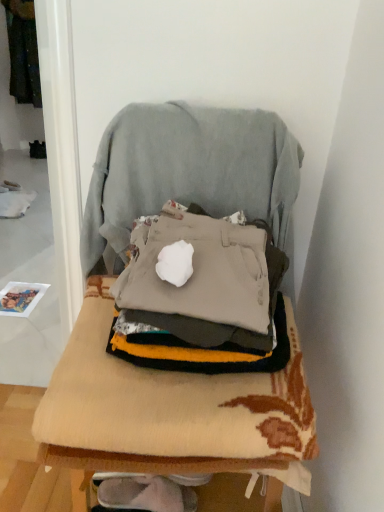
Question: From the image's perspective, is dark green fabric at upper left under light gray fabric swivel chair at center?

Choices:
 (A) yes
 (B) no

Answer: (B)

Question: From a real-world perspective, is dark green fabric at upper left over light gray fabric swivel chair at center?

Choices:
 (A) no
 (B) yes

Answer: (B)

Question: Is dark green fabric at upper left beside light gray fabric swivel chair at center?

Choices:
 (A) no
 (B) yes

Answer: (A)

Question: Can you confirm if dark green fabric at upper left is shorter than light gray fabric swivel chair at center?

Choices:
 (A) yes
 (B) no

Answer: (B)

Question: From a real-world perspective, is dark green fabric at upper left physically below light gray fabric swivel chair at center?

Choices:
 (A) no
 (B) yes

Answer: (A)

Question: Is dark green fabric at upper left positioned far away from light gray fabric swivel chair at center?

Choices:
 (A) no
 (B) yes

Answer: (B)

Question: From a real-world perspective, does beige knitted blanket at center sit lower than dark green fabric at upper left?

Choices:
 (A) no
 (B) yes

Answer: (B)

Question: Considering the relative sizes of beige knitted blanket at center and dark green fabric at upper left in the image provided, is beige knitted blanket at center wider than dark green fabric at upper left?

Choices:
 (A) no
 (B) yes

Answer: (B)

Question: Is beige knitted blanket at center smaller than dark green fabric at upper left?

Choices:
 (A) no
 (B) yes

Answer: (B)

Question: Is beige knitted blanket at center bigger than dark green fabric at upper left?

Choices:
 (A) no
 (B) yes

Answer: (A)

Question: Is beige knitted blanket at center closer to camera compared to dark green fabric at upper left?

Choices:
 (A) yes
 (B) no

Answer: (A)

Question: Does beige knitted blanket at center lie behind dark green fabric at upper left?

Choices:
 (A) no
 (B) yes

Answer: (A)

Question: Can you confirm if light gray fabric swivel chair at center is positioned to the left of beige fabric chair at center?

Choices:
 (A) no
 (B) yes

Answer: (A)